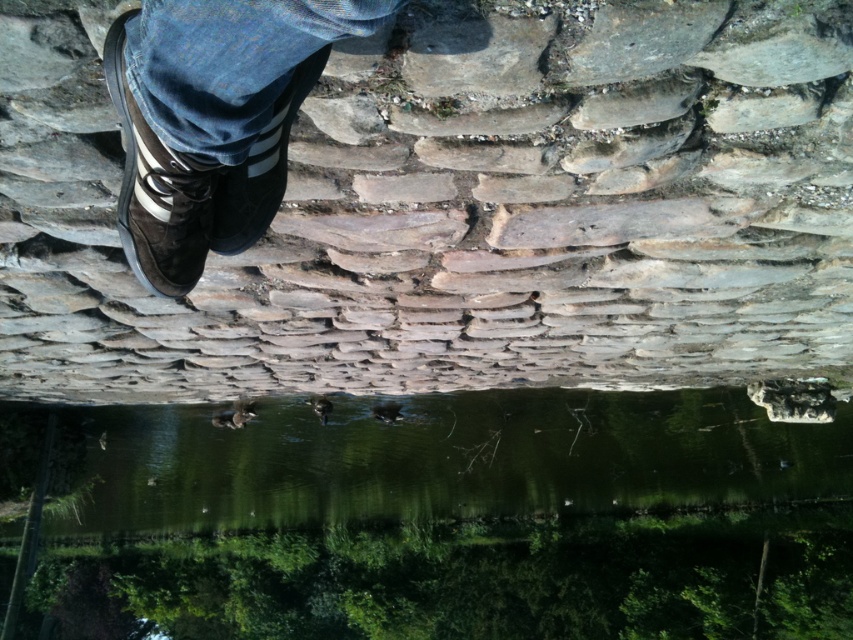
Question: Among these objects, which one is nearest to the camera?

Choices:
 (A) blue denim jeans at upper left
 (B) matte black shoe at upper left
 (C) brown suede shoe at upper left

Answer: (A)

Question: Which point is farther to the camera?

Choices:
 (A) (753, 106)
 (B) (589, 404)
 (C) (206, 1)
 (D) (235, 173)

Answer: (B)

Question: Is blue denim jeans at upper left wider than matte black shoe at upper left?

Choices:
 (A) yes
 (B) no

Answer: (A)

Question: Observing the image, what is the correct spatial positioning of brown suede shoe at upper left in reference to matte black shoe at upper left?

Choices:
 (A) right
 (B) left

Answer: (B)

Question: From the image, what is the correct spatial relationship of blue denim jeans at upper left in relation to matte black shoe at upper left?

Choices:
 (A) left
 (B) right

Answer: (B)

Question: Which of these objects is positioned farthest from the green reflective water at center?

Choices:
 (A) brown stone wall at upper center
 (B) blue denim jeans at upper left
 (C) matte black shoe at upper left
 (D) brown suede shoe at upper left

Answer: (B)